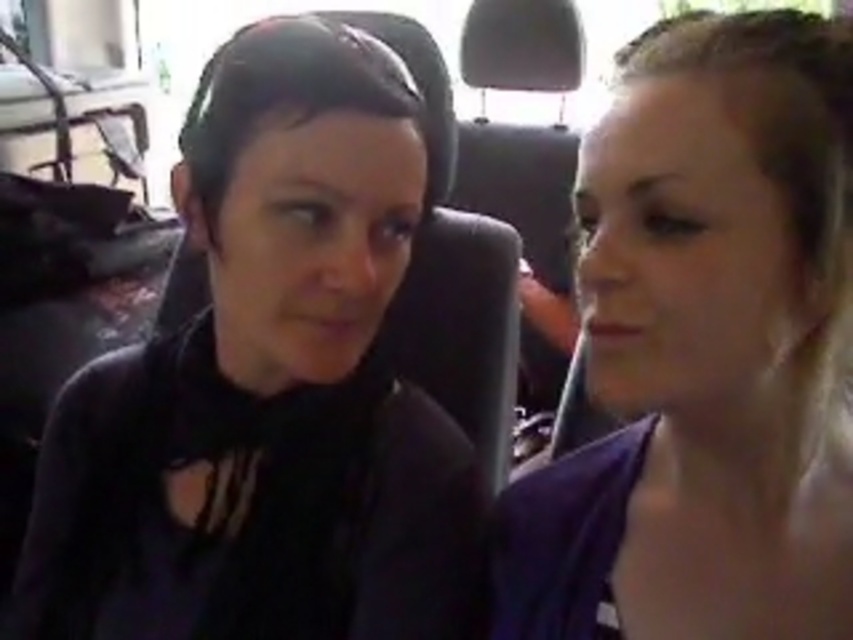
Question: Does black matte shirt at left appear under purple fabric at right?

Choices:
 (A) no
 (B) yes

Answer: (B)

Question: Where is black matte shirt at left located in relation to purple fabric at right in the image?

Choices:
 (A) right
 (B) left

Answer: (B)

Question: Which of the following is the farthest from the observer?

Choices:
 (A) black matte shirt at left
 (B) purple fabric at right

Answer: (A)

Question: Does black matte shirt at left lie in front of purple fabric at right?

Choices:
 (A) yes
 (B) no

Answer: (B)

Question: Which point is closer to the camera?

Choices:
 (A) (804, 477)
 (B) (239, 230)

Answer: (A)

Question: Which point is farther from the camera taking this photo?

Choices:
 (A) (618, 572)
 (B) (300, 129)

Answer: (B)